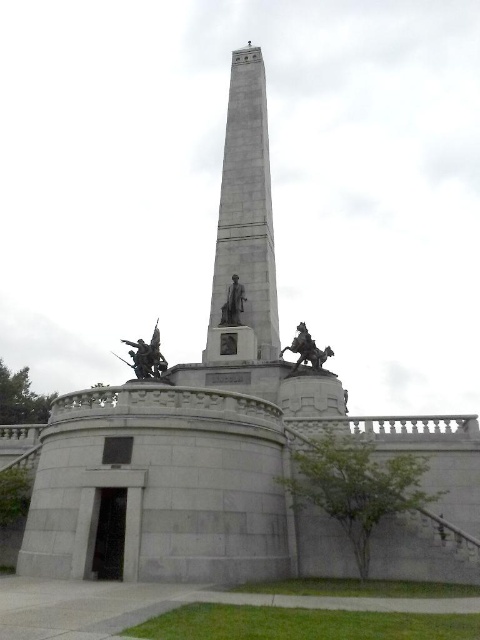
Question: Among these points, which one is farthest from the camera?

Choices:
 (A) (311, 349)
 (B) (223, 304)
 (C) (250, 172)
 (D) (148, 362)

Answer: (C)

Question: Which point appears farthest from the camera in this image?

Choices:
 (A) click(x=241, y=291)
 (B) click(x=265, y=317)
 (C) click(x=326, y=348)
 (D) click(x=156, y=349)

Answer: (D)

Question: Is gray stone obelisk at center smaller than polished bronze statue at center?

Choices:
 (A) no
 (B) yes

Answer: (A)

Question: Does bronze statue at center appear over polished bronze horse at right?

Choices:
 (A) no
 (B) yes

Answer: (A)

Question: Can you confirm if gray stone obelisk at center is smaller than bronze statue at center?

Choices:
 (A) no
 (B) yes

Answer: (A)

Question: Which object appears farthest from the camera in this image?

Choices:
 (A) gray stone obelisk at center
 (B) polished bronze statue at center
 (C) polished bronze horse at right

Answer: (A)